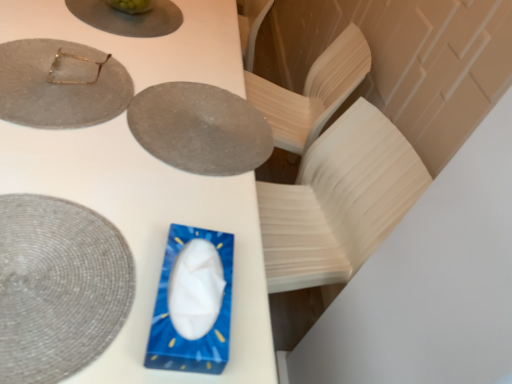
At what (x,y) coordinates should I click in order to perform the action: click on vacant point to the right of matte gray plate at upper center, positioned as the 1th plate in top-to-bottom order. Please return your answer as a coordinate pair (x, y). Looking at the image, I should click on (198, 50).